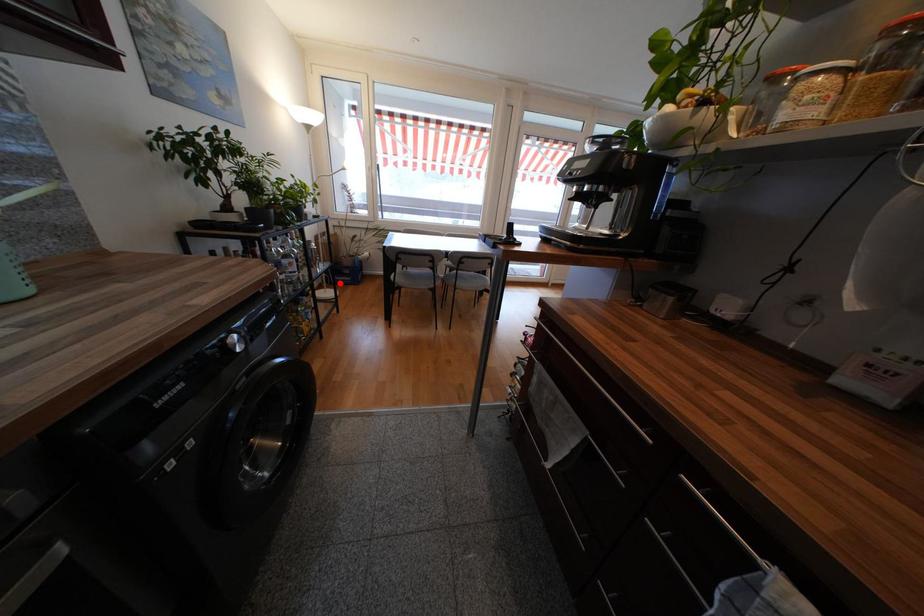
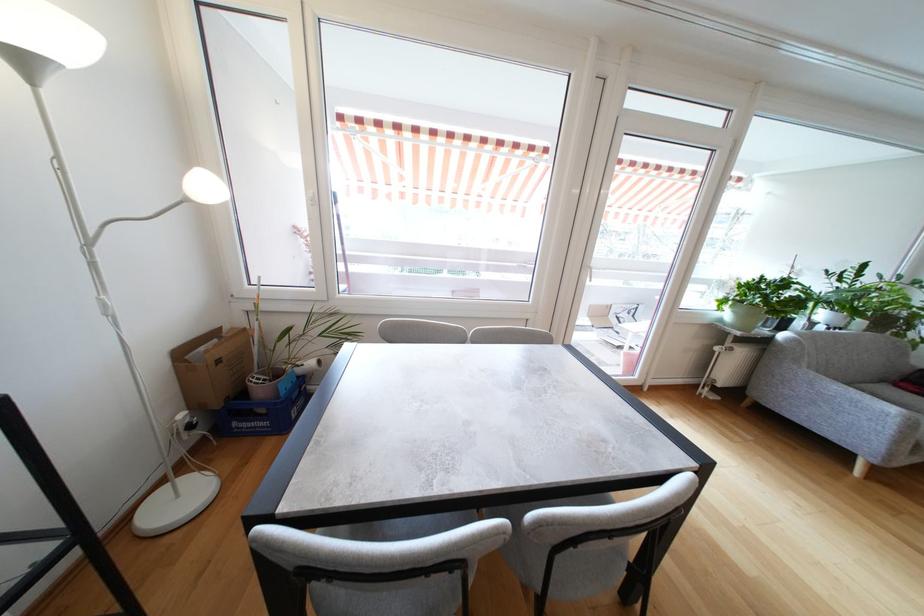
Where in the second image is the point corresponding to the highlighted location from the first image?

(239, 432)